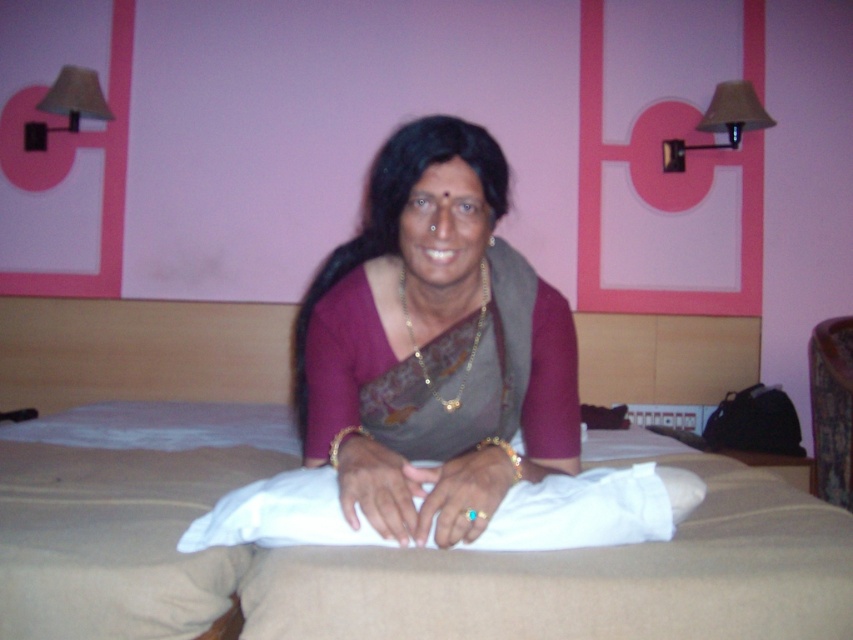
Question: Observing the image, what is the correct spatial positioning of beige fabric bed at center in reference to matte gray sari at center?

Choices:
 (A) above
 (B) below

Answer: (B)

Question: Is beige fabric bed at center to the right of matte gray sari at center from the viewer's perspective?

Choices:
 (A) no
 (B) yes

Answer: (B)

Question: Does beige fabric bed at center have a smaller size compared to matte gray sari at center?

Choices:
 (A) yes
 (B) no

Answer: (A)

Question: Which point is closer to the camera?

Choices:
 (A) matte gray sari at center
 (B) beige fabric bed at center

Answer: (B)

Question: Which of the following is the closest to the observer?

Choices:
 (A) beige fabric bed at center
 (B) matte gray sari at center

Answer: (A)